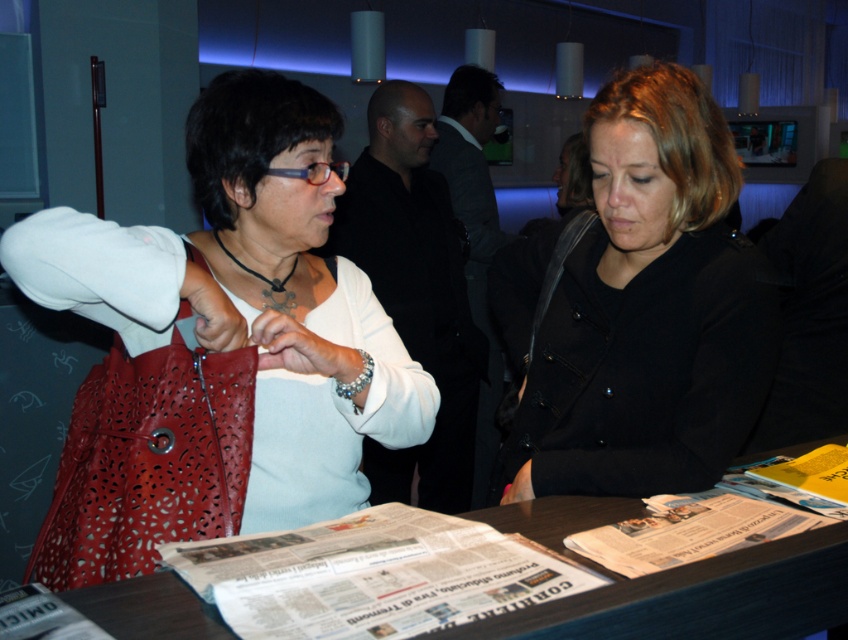
You are a bartender preparing to serve drinks to the two women at the table. You need to place a tray of drinks on the wooden table at center. However, there is a matte leather bag at left on the table. Can you place the tray there without moving the bag?

The matte leather bag at left is positioned over wooden table at center, so placing the tray there would require moving the bag to make space.

You are a guest at this event and need to retrieve your matte leather bag at left and white glossy newspaper at center. Which item is closer to the entrance of the lounge?

The matte leather bag at left is closer to the entrance because it is positioned to the left of the white glossy newspaper at center, and in the scene, the entrance is likely on the left side.